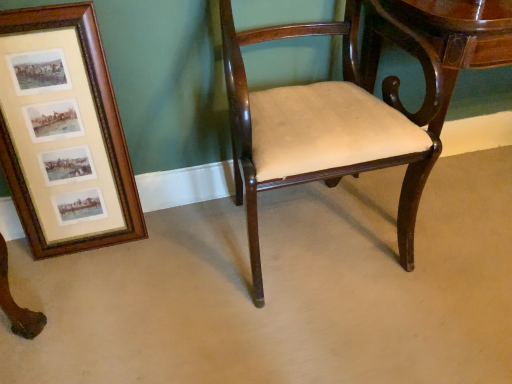
Question: In terms of size, does wooden frame at left appear bigger or smaller than glossy wood table at center?

Choices:
 (A) big
 (B) small

Answer: (B)

Question: Considering the positions of wooden frame at left and glossy wood table at center in the image, is wooden frame at left taller or shorter than glossy wood table at center?

Choices:
 (A) short
 (B) tall

Answer: (B)

Question: Considering the real-world distances, which object is farthest from the wooden frame at left?

Choices:
 (A) glossy wood table at center
 (B) mahogany wood chair at center

Answer: (A)

Question: Estimate the real-world distances between objects in this image. Which object is farther from the glossy wood table at center?

Choices:
 (A) mahogany wood chair at center
 (B) wooden frame at left

Answer: (B)